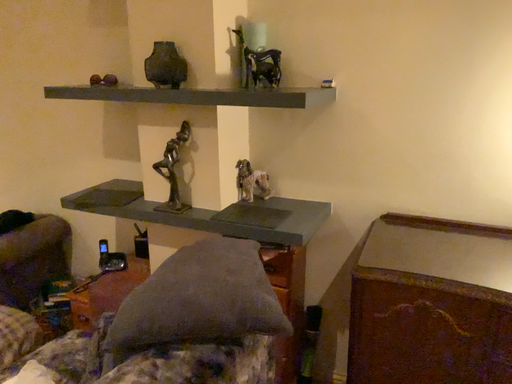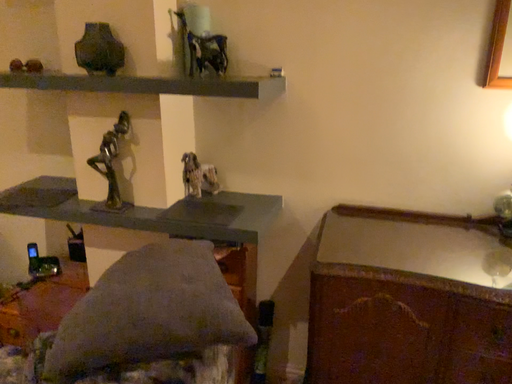
Question: How did the camera likely rotate when shooting the video?

Choices:
 (A) rotated right
 (B) rotated left

Answer: (A)